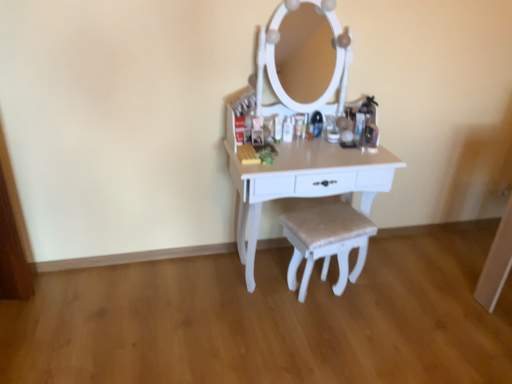
Where is `free space to the right of beige fabric stool at center`? free space to the right of beige fabric stool at center is located at coordinates (382, 301).